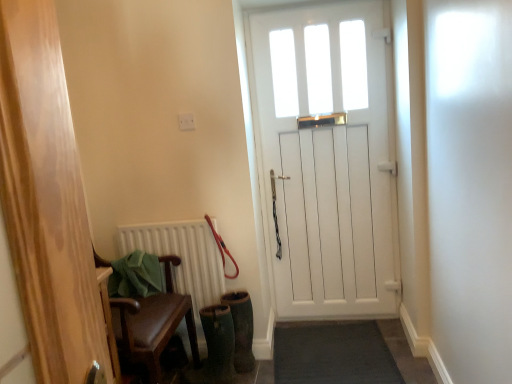
Find the location of a particular element. The image size is (512, 384). dark gray carpet at lower center is located at coordinates (334, 355).

This screenshot has height=384, width=512. Describe the element at coordinates (334, 355) in the screenshot. I see `dark gray carpet at lower center` at that location.

Locate an element on the screen. green suede boot at lower center is located at coordinates (241, 329).

Image resolution: width=512 pixels, height=384 pixels. What do you see at coordinates (222, 249) in the screenshot? I see `red rubber leash at center` at bounding box center [222, 249].

Locate an element on the screen. dark gray carpet at lower center is located at coordinates (334, 355).

Are dark gray carpet at lower center and red rubber leash at center making contact?

dark gray carpet at lower center and red rubber leash at center are not in contact.

Which is farther from the camera, (296, 372) or (205, 217)?

The point (205, 217) is behind.

Is dark gray carpet at lower center looking in the opposite direction of red rubber leash at center?

dark gray carpet at lower center does not have its back to red rubber leash at center.

From a real-world perspective, is white matte radiator at lower left physically below dark gray carpet at lower center?

No, from a real-world perspective, white matte radiator at lower left is not beneath dark gray carpet at lower center.

Which object is positioned more to the left, white matte radiator at lower left or dark gray carpet at lower center?

Positioned to the left is white matte radiator at lower left.

Between white matte radiator at lower left and dark gray carpet at lower center, which one has smaller size?

With smaller size is white matte radiator at lower left.

Which object is thinner, white matte radiator at lower left or dark gray carpet at lower center?

white matte radiator at lower left.

This screenshot has width=512, height=384. What are the coordinates of `doormat on the right of the white wooden door at center` in the screenshot? It's located at (334, 355).

Is white wooden door at center to the left of dark gray carpet at lower center from the viewer's perspective?

Indeed, white wooden door at center is positioned on the left side of dark gray carpet at lower center.

Is white wooden door at center taller than dark gray carpet at lower center?

Correct, white wooden door at center is much taller as dark gray carpet at lower center.

Is dark gray carpet at lower center spatially inside green suede boot at lower center, or outside of it?

dark gray carpet at lower center exists outside the volume of green suede boot at lower center.

Is dark gray carpet at lower center taller than green suede boot at lower center?

Incorrect, the height of dark gray carpet at lower center is not larger of that of green suede boot at lower center.

Which is behind, dark gray carpet at lower center or green suede boot at lower center?

green suede boot at lower center is behind.

Can you confirm if white matte radiator at lower left is bigger than white wooden door at center?

Actually, white matte radiator at lower left might be smaller than white wooden door at center.

From the image's perspective, who appears lower, white matte radiator at lower left or white wooden door at center?

white matte radiator at lower left appears lower in the image.

Is white matte radiator at lower left thinner than white wooden door at center?

Indeed, white matte radiator at lower left has a lesser width compared to white wooden door at center.

Who is more distant, white matte radiator at lower left or red rubber leash at center?

white matte radiator at lower left.

Which object is positioned more to the left, white matte radiator at lower left or red rubber leash at center?

white matte radiator at lower left is more to the left.

From the image's perspective, is white matte radiator at lower left located above red rubber leash at center?

No, from the image's perspective, white matte radiator at lower left is not over red rubber leash at center.

Are white matte radiator at lower left and red rubber leash at center beside each other?

No, white matte radiator at lower left is not in contact with red rubber leash at center.

From a real-world perspective, is red rubber leash at center positioned above or below dark gray carpet at lower center?

From a real-world perspective, red rubber leash at center is physically above dark gray carpet at lower center.

You are a GUI agent. You are given a task and a screenshot of the screen. Output one action in this format:
    pyautogui.click(x=<x>, y=<y>)
    Task: Click on the leash located above the dark gray carpet at lower center (from a real-world perspective)
    This screenshot has height=384, width=512.
    Given the screenshot: What is the action you would take?
    pyautogui.click(x=222, y=249)

From the image's perspective, who appears lower, red rubber leash at center or dark gray carpet at lower center?

dark gray carpet at lower center.

Image resolution: width=512 pixels, height=384 pixels. In order to click on doormat located below the red rubber leash at center (from the image's perspective) in this screenshot , I will do `click(334, 355)`.

Locate an element on the screen. doormat in front of the white matte radiator at lower left is located at coordinates (334, 355).

Based on their spatial positions, is white matte radiator at lower left or dark gray carpet at lower center further from white wooden door at center?

Among the two, white matte radiator at lower left is located further to white wooden door at center.

Which object lies further to the anchor point green suede boot at lower center, white wooden door at center or dark gray carpet at lower center?

Based on the image, white wooden door at center appears to be further to green suede boot at lower center.

When comparing their distances from white matte radiator at lower left, does white wooden door at center or red rubber leash at center seem further?

white wooden door at center lies further to white matte radiator at lower left than the other object.

Estimate the real-world distances between objects in this image. Which object is further from white matte radiator at lower left, white wooden door at center or green suede boot at lower center?

Among the two, white wooden door at center is located further to white matte radiator at lower left.

Based on their spatial positions, is green suede boot at lower center or white matte radiator at lower left closer to white wooden door at center?

white matte radiator at lower left.

Estimate the real-world distances between objects in this image. Which object is closer to white matte radiator at lower left, green suede boot at lower center or white wooden door at center?

green suede boot at lower center is positioned closer to the anchor white matte radiator at lower left.

Considering their positions, is red rubber leash at center positioned further to white matte radiator at lower left than dark gray carpet at lower center?

Based on the image, dark gray carpet at lower center appears to be further to white matte radiator at lower left.

From the image, which object appears to be farther from white wooden door at center, dark gray carpet at lower center or white matte radiator at lower left?

white matte radiator at lower left.

Identify the location of leash between white wooden door at center and dark gray carpet at lower center in the vertical direction. (222, 249).

Find the location of `leash between white matte radiator at lower left and white wooden door at center from left to right`. leash between white matte radiator at lower left and white wooden door at center from left to right is located at coordinates (222, 249).

The height and width of the screenshot is (384, 512). Identify the location of leash between white wooden door at center and green suede boot at lower center in the up-down direction. (222, 249).

The width and height of the screenshot is (512, 384). Identify the location of boot between white matte radiator at lower left and dark gray carpet at lower center in the horizontal direction. (241, 329).